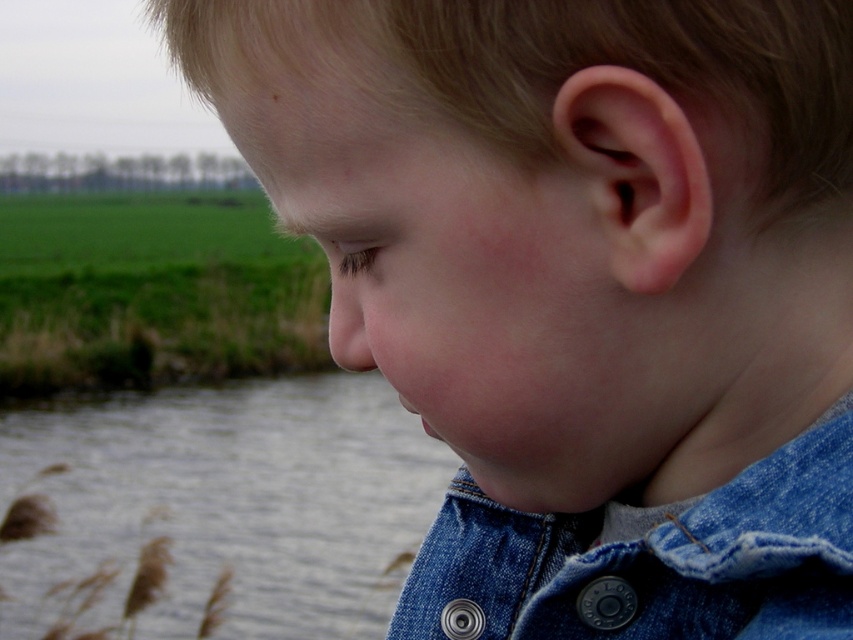
You are a photographer trying to capture a shot of the gray water at lower left and the denim jacket at lower right. Based on their positions, which object would appear closer to the camera in the photo?

The gray water at lower left is taller than the denim jacket at lower right, so it would appear closer to the camera in the photo because objects that are taller in the frame are typically closer to the viewer.

You are a photographer trying to focus on the smooth flesh nose at center and the denim jacket at lower right. Which object is closer to your camera lens?

The denim jacket at lower right is closer to the viewer than the smooth flesh nose at center, so the denim jacket at lower right would be in focus first.

Consider the image. Based on the scene described, which object, the gray water at lower left or the denim jacket at lower right, occupies a larger area in the image?

The gray water at lower left might be wider than the denim jacket at lower right according to the description.